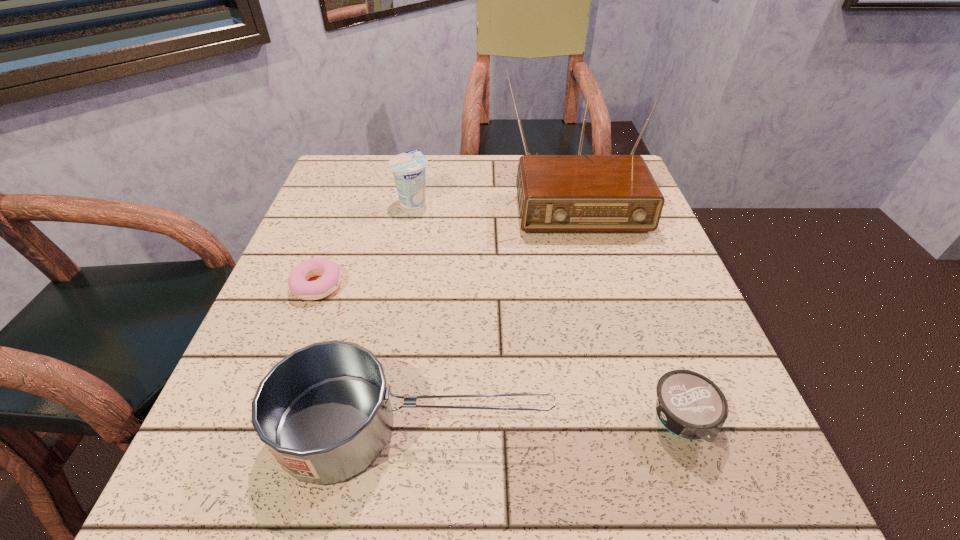
You are a GUI agent. You are given a task and a screenshot of the screen. Output one action in this format:
    pyautogui.click(x=<x>, y=<y>)
    Task: Click on the radio_receiver
    The height and width of the screenshot is (540, 960).
    Given the screenshot: What is the action you would take?
    (556, 193)

You are a GUI agent. You are given a task and a screenshot of the screen. Output one action in this format:
    pyautogui.click(x=<x>, y=<y>)
    Task: Click on the taller yogurt
    This screenshot has height=540, width=960.
    Given the screenshot: What is the action you would take?
    pyautogui.click(x=408, y=168)

You are a GUI agent. You are given a task and a screenshot of the screen. Output one action in this format:
    pyautogui.click(x=<x>, y=<y>)
    Task: Click on the left yogurt
    
    Given the screenshot: What is the action you would take?
    pyautogui.click(x=408, y=168)

Find the location of `saucepan`. saucepan is located at coordinates (324, 412).

Find the location of `the right yogurt`. the right yogurt is located at coordinates (689, 405).

Locate an element on the screen. This screenshot has height=540, width=960. the shorter yogurt is located at coordinates (689, 405).

Where is `pastry`? Image resolution: width=960 pixels, height=540 pixels. pastry is located at coordinates (329, 271).

Find the location of a particular element. the shortest object is located at coordinates (329, 271).

At what (x,y) coordinates should I click in order to perform the action: click on vacant region located 0.310m on the front panel of the radio_receiver. Please return your answer as a coordinate pair (x, y). Looking at the image, I should click on (613, 347).

Find the location of a particular element. This screenshot has width=960, height=540. free spot located on the front of the taller yogurt is located at coordinates (395, 298).